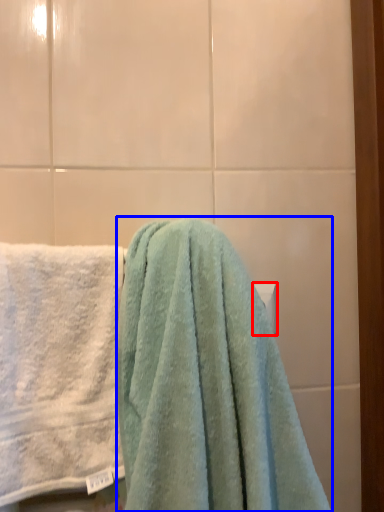
Question: Among these objects, which one is nearest to the camera, towel bar (highlighted by a red box) or towel (highlighted by a blue box)?

Choices:
 (A) towel bar
 (B) towel

Answer: (B)